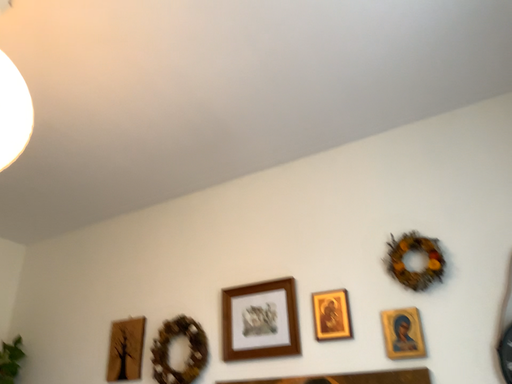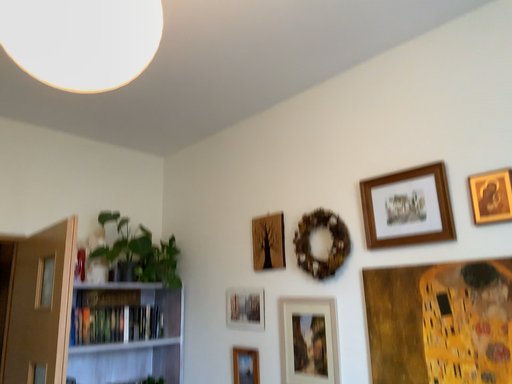
Question: Which way did the camera rotate in the video?

Choices:
 (A) rotated right
 (B) rotated left

Answer: (B)